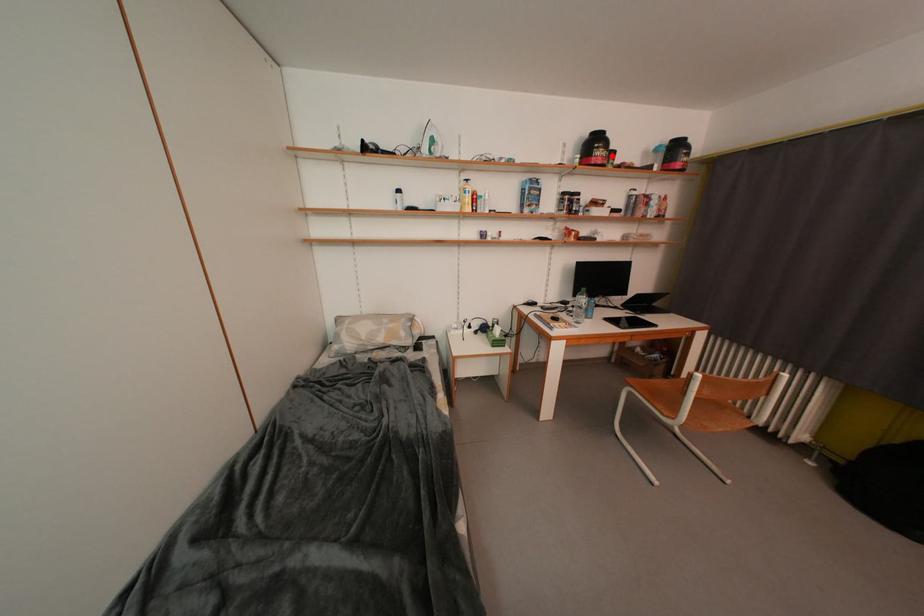
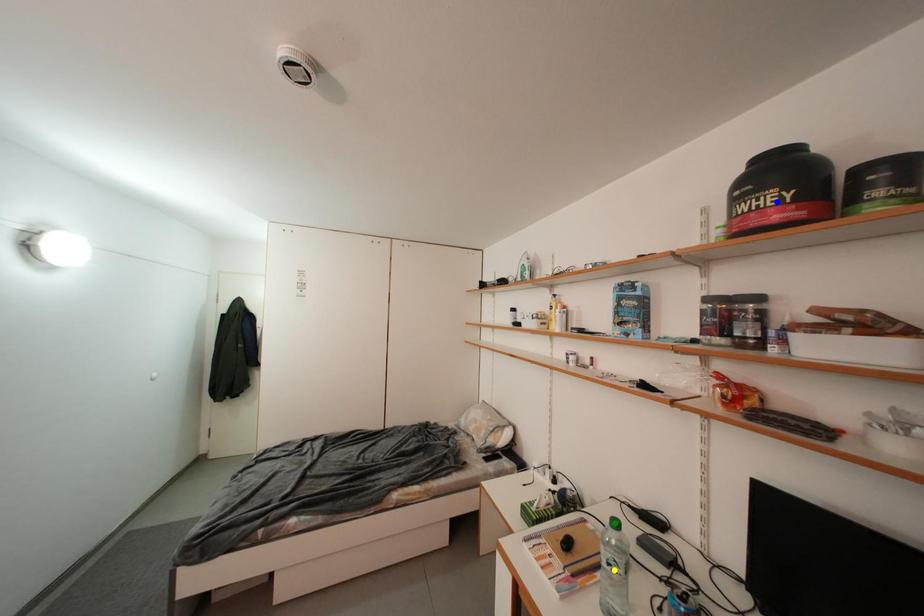
Question: I am providing you with two images of the same scene from different viewpoints. A red point is marked on the first image. You are given multiple points on the second image. Which mark in image 2 goes with the point in image 1?

Choices:
 (A) green point
 (B) yellow point
 (C) blue point

Answer: (C)